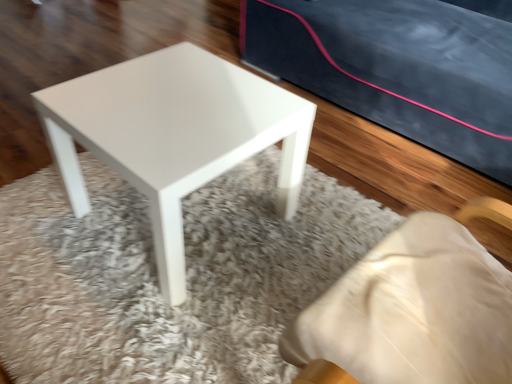
Question: Is white glossy stool at center to the right of matte black mat at upper center from the viewer's perspective?

Choices:
 (A) no
 (B) yes

Answer: (A)

Question: Is white glossy stool at center at the left side of matte black mat at upper center?

Choices:
 (A) yes
 (B) no

Answer: (A)

Question: From a real-world perspective, is white glossy stool at center on top of matte black mat at upper center?

Choices:
 (A) yes
 (B) no

Answer: (A)

Question: Is white glossy stool at center facing towards matte black mat at upper center?

Choices:
 (A) yes
 (B) no

Answer: (B)

Question: Can you confirm if white glossy stool at center is smaller than matte black mat at upper center?

Choices:
 (A) yes
 (B) no

Answer: (A)

Question: Can you confirm if white glossy stool at center is shorter than matte black mat at upper center?

Choices:
 (A) no
 (B) yes

Answer: (A)

Question: Considering the relative sizes of matte black mat at upper center and white glossy stool at center in the image provided, is matte black mat at upper center shorter than white glossy stool at center?

Choices:
 (A) yes
 (B) no

Answer: (A)

Question: From the image's perspective, is matte black mat at upper center located beneath white glossy stool at center?

Choices:
 (A) no
 (B) yes

Answer: (B)

Question: Considering the relative positions of matte black mat at upper center and white glossy stool at center in the image provided, is matte black mat at upper center to the right of white glossy stool at center from the viewer's perspective?

Choices:
 (A) yes
 (B) no

Answer: (A)

Question: Does matte black mat at upper center have a larger size compared to white glossy stool at center?

Choices:
 (A) no
 (B) yes

Answer: (B)

Question: Is matte black mat at upper center in contact with white glossy stool at center?

Choices:
 (A) no
 (B) yes

Answer: (A)

Question: Is matte black mat at upper center facing towards white glossy stool at center?

Choices:
 (A) yes
 (B) no

Answer: (B)

Question: From the image's perspective, relative to white glossy stool at center, is matte black mat at upper center above or below?

Choices:
 (A) below
 (B) above

Answer: (A)